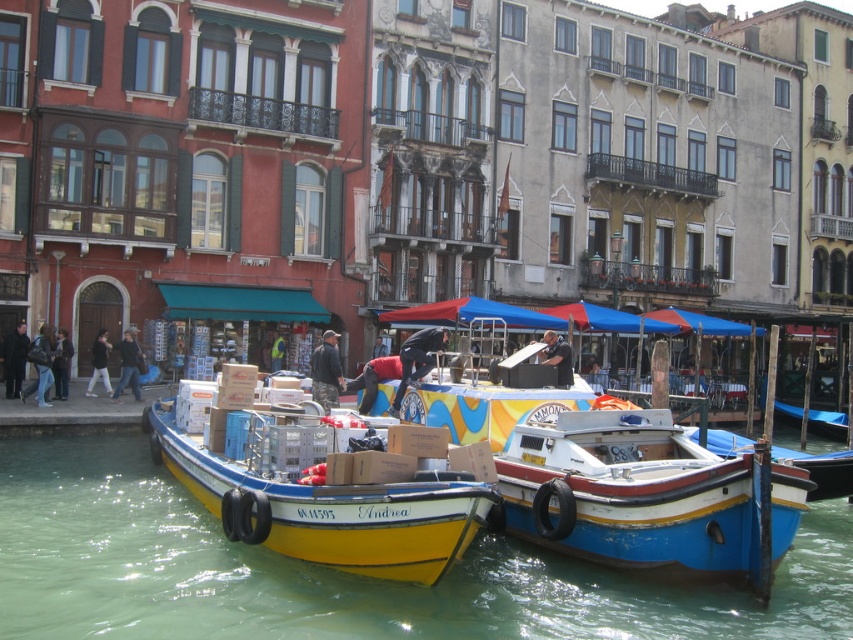
Between blue painted wood boat at right and dark brown leather jacket at lower left, which one has less height?

With less height is dark brown leather jacket at lower left.

Can you confirm if blue painted wood boat at right is thinner than dark brown leather jacket at lower left?

No.

What do you see at coordinates (647, 497) in the screenshot? I see `blue painted wood boat at right` at bounding box center [647, 497].

I want to click on blue painted wood boat at right, so click(x=647, y=497).

Measure the distance from black fabric jacket at center to jeans at lower left.

The distance of black fabric jacket at center from jeans at lower left is 73.92 feet.

Based on the photo, who is higher up, black fabric jacket at center or jeans at lower left?

black fabric jacket at center is above.

Does point (434, 364) lie in front of point (44, 388)?

Yes, point (434, 364) is closer to viewer.

This screenshot has width=853, height=640. I want to click on black fabric jacket at center, so click(416, 358).

Which is more to the right, blue painted wood boat at right or jeans at lower left?

blue painted wood boat at right

Does blue painted wood boat at right have a lesser width compared to jeans at lower left?

Incorrect, blue painted wood boat at right's width is not less than jeans at lower left's.

Locate an element on the screen. blue painted wood boat at right is located at coordinates (647, 497).